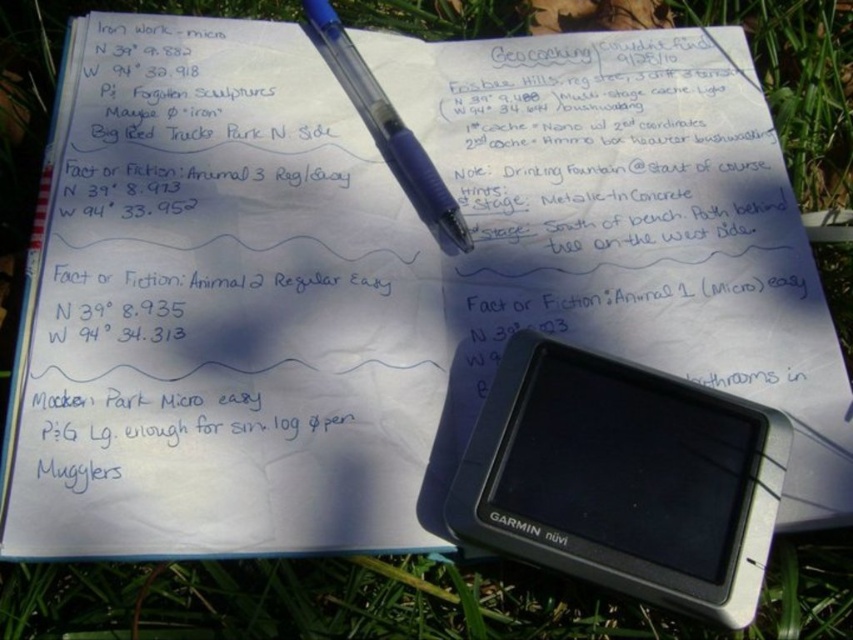
Question: Is black plastic gps at center positioned before blue plastic pen at upper center?

Choices:
 (A) no
 (B) yes

Answer: (B)

Question: Where is black plastic gps at center located in relation to blue plastic pen at upper center in the image?

Choices:
 (A) above
 (B) below

Answer: (B)

Question: Which point appears closest to the camera in this image?

Choices:
 (A) (549, 371)
 (B) (349, 97)

Answer: (A)

Question: Does black plastic gps at center have a lesser width compared to blue plastic pen at upper center?

Choices:
 (A) yes
 (B) no

Answer: (B)